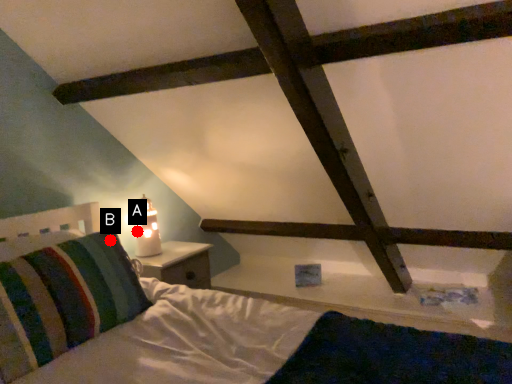
Question: Two points are circled on the image, labeled by A and B beside each circle. Which point is farther from the camera taking this photo?

Choices:
 (A) A is further
 (B) B is further

Answer: (A)